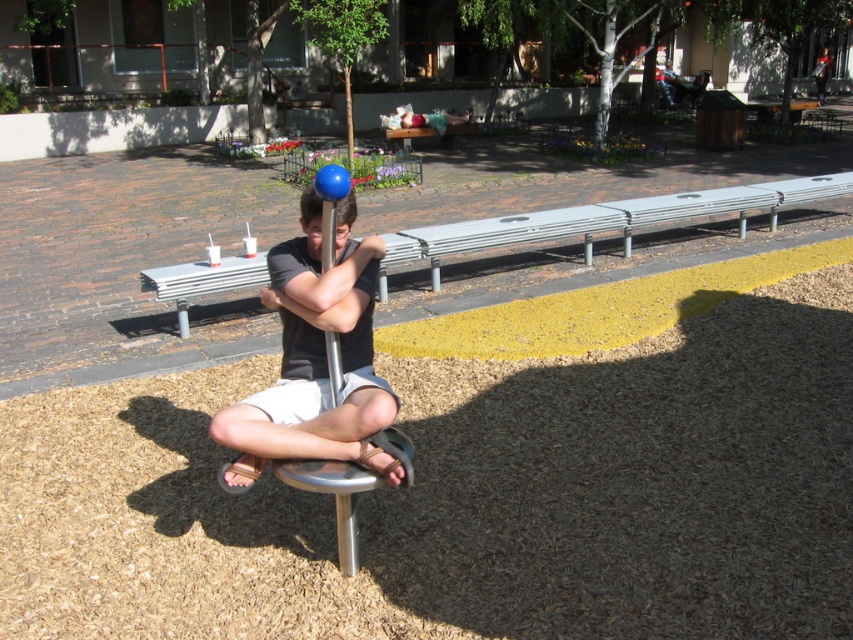
Question: Is metallic silver bench at center positioned behind blue glossy pole at center?

Choices:
 (A) yes
 (B) no

Answer: (A)

Question: Which object appears closest to the camera in this image?

Choices:
 (A) metallic silver bench at center
 (B) blue glossy pole at center
 (C) matte black man at center

Answer: (B)

Question: Which point is farther to the camera?

Choices:
 (A) (328, 342)
 (B) (332, 316)
 (C) (631, 250)

Answer: (C)

Question: Does matte black man at center have a lesser width compared to metallic silver bench at center?

Choices:
 (A) no
 (B) yes

Answer: (A)

Question: Can you confirm if metallic silver bench at center is wider than blue glossy pole at center?

Choices:
 (A) no
 (B) yes

Answer: (A)

Question: Which point appears closest to the camera in this image?

Choices:
 (A) pyautogui.click(x=334, y=388)
 (B) pyautogui.click(x=293, y=310)
 (C) pyautogui.click(x=212, y=285)

Answer: (B)